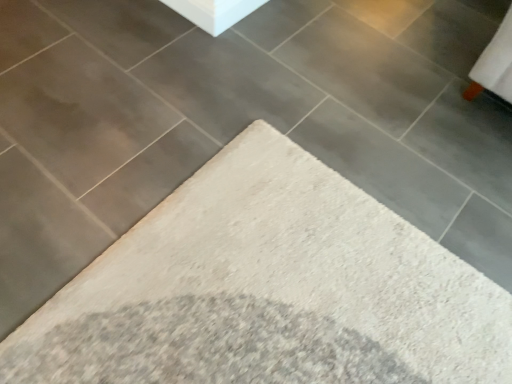
Question: From the image's perspective, is white shag rug at center over white smooth concrete at upper center?

Choices:
 (A) yes
 (B) no

Answer: (B)

Question: Can you confirm if white shag rug at center is positioned to the left of white smooth concrete at upper center?

Choices:
 (A) yes
 (B) no

Answer: (A)

Question: Is the position of white shag rug at center more distant than that of white smooth concrete at upper center?

Choices:
 (A) no
 (B) yes

Answer: (A)

Question: Is white shag rug at center outside white smooth concrete at upper center?

Choices:
 (A) no
 (B) yes

Answer: (B)

Question: Can you confirm if white shag rug at center is smaller than white smooth concrete at upper center?

Choices:
 (A) yes
 (B) no

Answer: (B)

Question: Is white smooth concrete at upper center at the back of white shag rug at center?

Choices:
 (A) yes
 (B) no

Answer: (B)

Question: From a real-world perspective, does white smooth concrete at upper center sit lower than white shag rug at center?

Choices:
 (A) yes
 (B) no

Answer: (B)

Question: Does white smooth concrete at upper center come behind white shag rug at center?

Choices:
 (A) yes
 (B) no

Answer: (A)

Question: Could you tell me if white smooth concrete at upper center is facing white shag rug at center?

Choices:
 (A) yes
 (B) no

Answer: (B)

Question: From the image's perspective, is white smooth concrete at upper center located above white shag rug at center?

Choices:
 (A) yes
 (B) no

Answer: (A)

Question: Is white smooth concrete at upper center directly adjacent to white shag rug at center?

Choices:
 (A) yes
 (B) no

Answer: (B)

Question: Does white smooth concrete at upper center have a larger size compared to white shag rug at center?

Choices:
 (A) yes
 (B) no

Answer: (B)

Question: From their relative heights in the image, would you say white shag rug at center is taller or shorter than white smooth concrete at upper center?

Choices:
 (A) tall
 (B) short

Answer: (B)